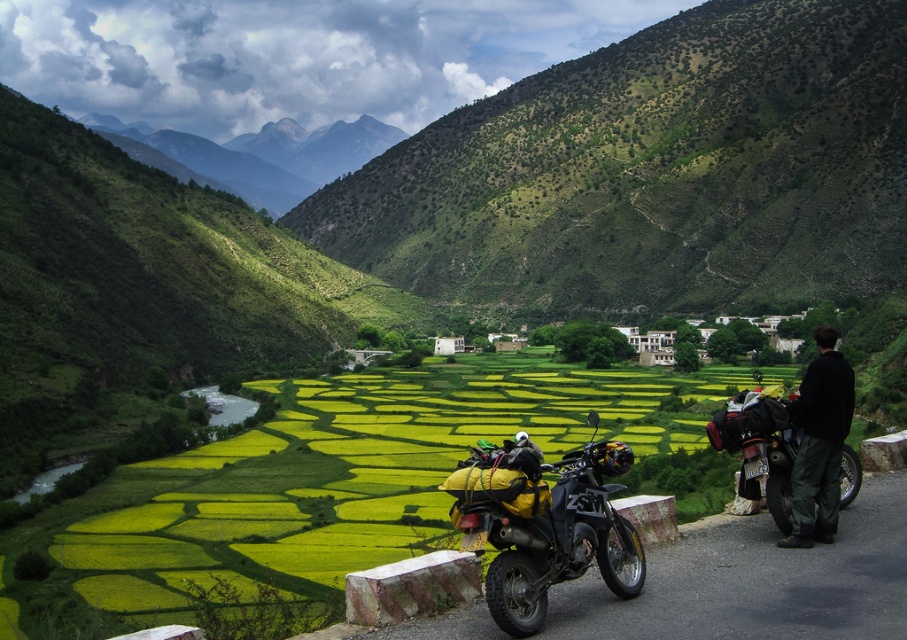
Looking at this image, you are a photographer planning to capture both the matte black motorcycle at center and the black textured motorcycle at right in a single frame. Given their sizes, which motorcycle would appear closer to the camera in the photo?

The matte black motorcycle at center appears smaller than the black textured motorcycle at right, so in the photo, the black textured motorcycle at right would appear closer to the camera because larger objects in a frame typically indicate proximity.

You are a photographer planning to capture a wide shot of the rural landscape scene. You need to ensure that both the black softshell jacket at right and the black textured motorcycle at right are fully visible in the frame. Given their widths, which object should you position closer to the center of the frame to avoid cropping?

The black softshell jacket at right has a greater width than the black textured motorcycle at right. To ensure both are fully visible without cropping, position the black softshell jacket at right closer to the center of the frame.

You are standing at the starting point of the mountain trail and see two points marked on the map. The first point is at coordinates point (797, 272) and the second point is at coordinates point (734, 404). Which point is closer to your current position?

Point (797, 272) is closer to your current position because it is further to the viewer than point (734, 404), meaning it is physically nearer to you.